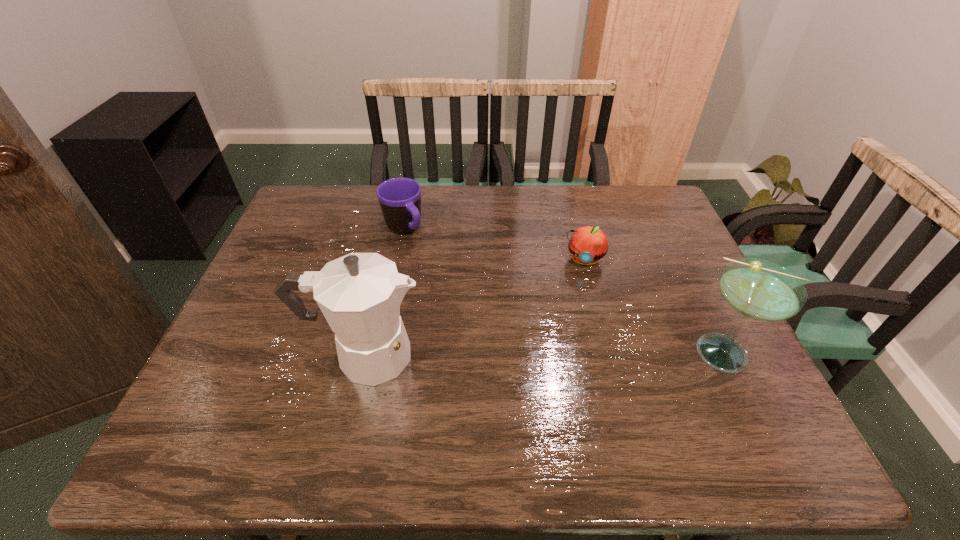
This screenshot has height=540, width=960. Find the location of `free space at the near edge of the desktop`. free space at the near edge of the desktop is located at coordinates (575, 381).

You are a GUI agent. You are given a task and a screenshot of the screen. Output one action in this format:
    pyautogui.click(x=<x>, y=<y>)
    Task: Click on the free location at the left edge
    
    Given the screenshot: What is the action you would take?
    pyautogui.click(x=282, y=352)

The width and height of the screenshot is (960, 540). I want to click on free space at the right edge of the desktop, so click(674, 253).

Image resolution: width=960 pixels, height=540 pixels. Find the location of `vacant position at the far left corner of the desktop`. vacant position at the far left corner of the desktop is located at coordinates (311, 195).

Where is `unoccupied position between the tallest object and the third nearest object`? The image size is (960, 540). unoccupied position between the tallest object and the third nearest object is located at coordinates (474, 307).

Find the location of a particular element. blank region between the third nearest object and the second tallest object is located at coordinates (656, 306).

Locate an element on the screen. free space between the apple and the farthest object is located at coordinates click(493, 245).

Locate an element on the screen. This screenshot has height=540, width=960. free space between the martini and the tallest object is located at coordinates (546, 354).

I want to click on vacant area between the second tallest object and the coffeepot, so click(x=546, y=354).

At what (x,y) coordinates should I click in order to perform the action: click on free space between the third shortest object and the third nearest object. Please return your answer as a coordinate pair (x, y). Looking at the image, I should click on (656, 306).